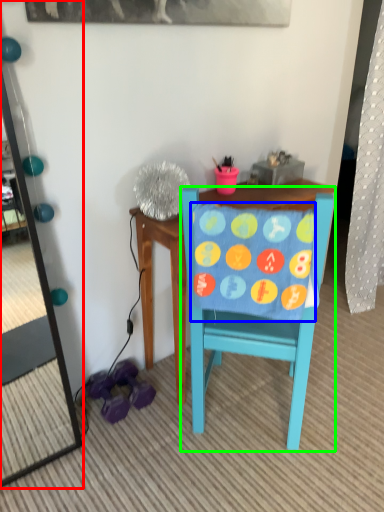
Question: Which is farther away from mirror (highlighted by a red box)? blanket (highlighted by a blue box) or chair (highlighted by a green box)?

Choices:
 (A) blanket
 (B) chair

Answer: (A)